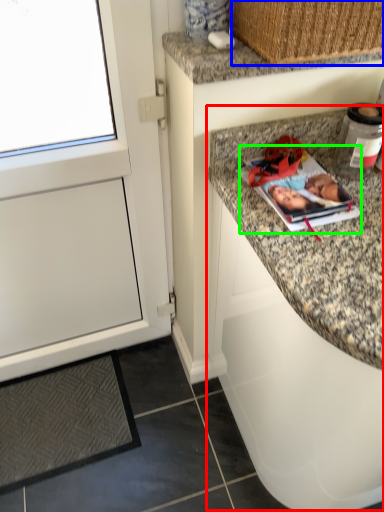
Question: Considering the real-world distances, which object is farthest from cabinetry (highlighted by a red box)? basket (highlighted by a blue box) or magazine (highlighted by a green box)?

Choices:
 (A) basket
 (B) magazine

Answer: (A)